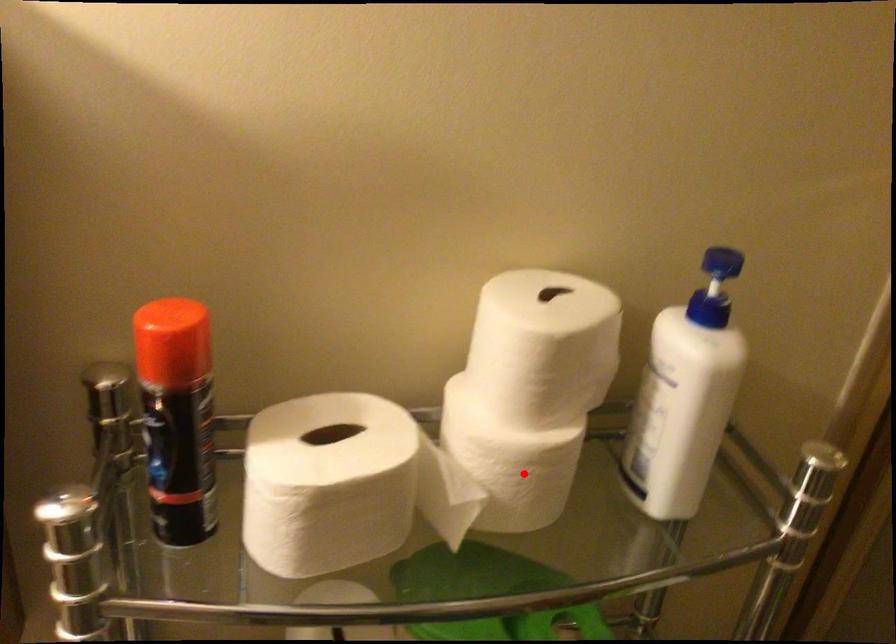
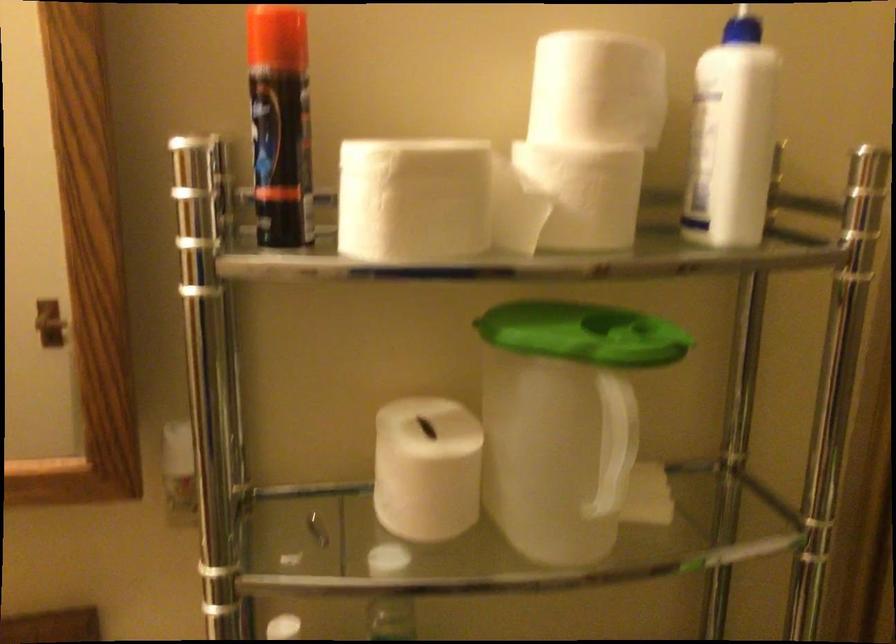
Question: A red point is marked in image1. In image2, is the corresponding 3D point closer to the camera or farther? Reply with the corresponding letter.

Choices:
 (A) The corresponding 3D point is closer.
 (B) The corresponding 3D point is farther.

Answer: (B)